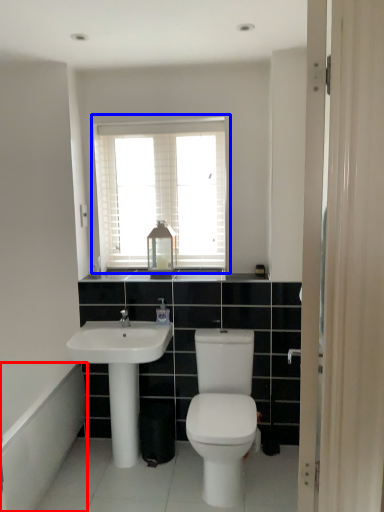
Question: Which object is further to the camera taking this photo, bath (highlighted by a red box) or window (highlighted by a blue box)?

Choices:
 (A) bath
 (B) window

Answer: (B)